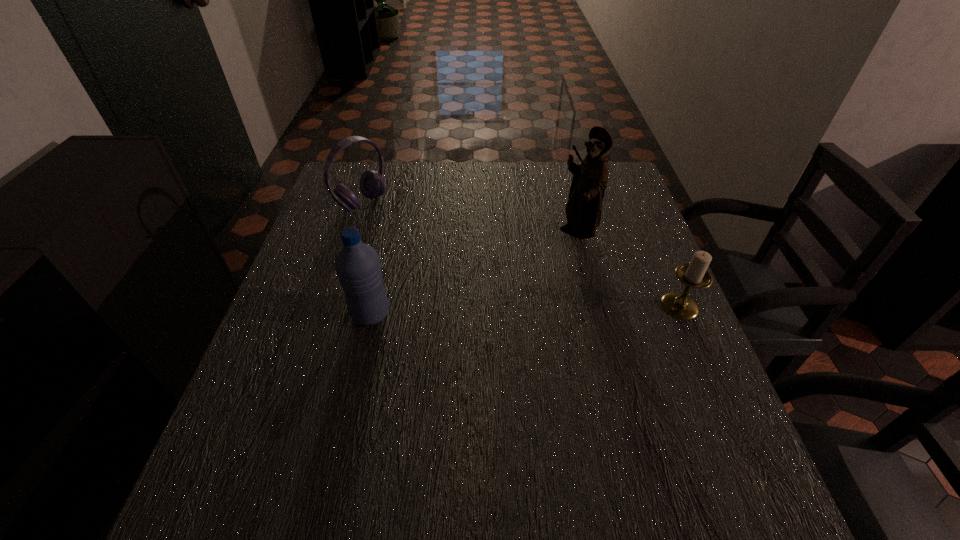
Locate an element on the screen. This screenshot has height=540, width=960. free spot on the desktop that is between the water bottle and the shortest object and is positioned on the headband and ear cups of the headset is located at coordinates point(519,310).

You are a GUI agent. You are given a task and a screenshot of the screen. Output one action in this format:
    pyautogui.click(x=<x>, y=<y>)
    Task: Click on the vacant spot on the desktop that is between the third shortest object and the rightmost object and is positioned on the front-facing side of the tallest object
    This screenshot has height=540, width=960.
    Given the screenshot: What is the action you would take?
    pyautogui.click(x=534, y=309)